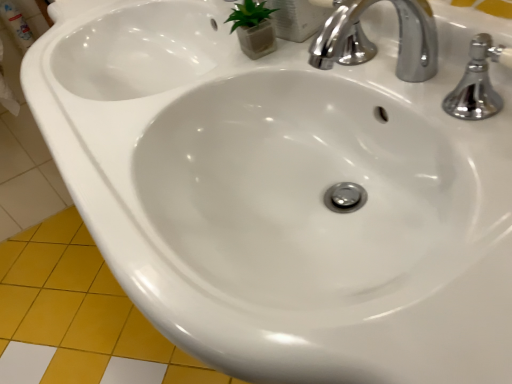
Locate an element on the screen. The width and height of the screenshot is (512, 384). polished chrome faucet at upper right is located at coordinates (476, 83).

The height and width of the screenshot is (384, 512). What do you see at coordinates (476, 83) in the screenshot?
I see `polished chrome faucet at upper right` at bounding box center [476, 83].

This screenshot has width=512, height=384. I want to click on yellow matte tile at lower left, so click(x=78, y=316).

The height and width of the screenshot is (384, 512). Describe the element at coordinates (78, 316) in the screenshot. I see `yellow matte tile at lower left` at that location.

You are a GUI agent. You are given a task and a screenshot of the screen. Output one action in this format:
    pyautogui.click(x=<x>, y=<y>)
    Task: Click on the polished chrome faucet at upper right
    
    Given the screenshot: What is the action you would take?
    pyautogui.click(x=476, y=83)

Which is more to the right, polished chrome faucet at upper right or yellow matte tile at lower left?

From the viewer's perspective, polished chrome faucet at upper right appears more on the right side.

Does polished chrome faucet at upper right come behind yellow matte tile at lower left?

No, polished chrome faucet at upper right is in front of yellow matte tile at lower left.

Does point (493, 94) come farther from viewer compared to point (110, 334)?

No.

From the image's perspective, is polished chrome faucet at upper right located above yellow matte tile at lower left?

Correct, polished chrome faucet at upper right appears higher than yellow matte tile at lower left in the image.

Consider the image. From a real-world perspective, is polished chrome faucet at upper right physically located above or below yellow matte tile at lower left?

polished chrome faucet at upper right is above yellow matte tile at lower left.

Which object is wider, polished chrome faucet at upper right or yellow matte tile at lower left?

yellow matte tile at lower left.

From their relative heights in the image, would you say polished chrome faucet at upper right is taller or shorter than yellow matte tile at lower left?

Considering their sizes, polished chrome faucet at upper right has more height than yellow matte tile at lower left.

Between polished chrome faucet at upper right and yellow matte tile at lower left, which one has smaller size?

polished chrome faucet at upper right.

Would you say polished chrome faucet at upper right is outside yellow matte tile at lower left?

Absolutely, polished chrome faucet at upper right is external to yellow matte tile at lower left.

Is polished chrome faucet at upper right positioned far away from yellow matte tile at lower left?

polished chrome faucet at upper right is far away from yellow matte tile at lower left.

Is polished chrome faucet at upper right aimed at yellow matte tile at lower left?

No, polished chrome faucet at upper right is not turned towards yellow matte tile at lower left.

This screenshot has height=384, width=512. In order to click on ceramic tile lying behind the polished chrome faucet at upper right in this screenshot , I will do `click(78, 316)`.

Considering the relative positions of yellow matte tile at lower left and polished chrome faucet at upper right in the image provided, is yellow matte tile at lower left to the right of polished chrome faucet at upper right from the viewer's perspective?

No, yellow matte tile at lower left is not to the right of polished chrome faucet at upper right.

In the image, is yellow matte tile at lower left positioned in front of or behind polished chrome faucet at upper right?

Visually, yellow matte tile at lower left is located behind polished chrome faucet at upper right.

Does point (80, 354) come in front of point (510, 58)?

No.

In the scene shown: From the image's perspective, does yellow matte tile at lower left appear lower than polished chrome faucet at upper right?

Yes.

From a real-world perspective, between yellow matte tile at lower left and polished chrome faucet at upper right, who is vertically lower?

yellow matte tile at lower left.

Considering the sizes of objects yellow matte tile at lower left and polished chrome faucet at upper right in the image provided, who is thinner, yellow matte tile at lower left or polished chrome faucet at upper right?

With smaller width is polished chrome faucet at upper right.

Considering the sizes of yellow matte tile at lower left and polished chrome faucet at upper right in the image, is yellow matte tile at lower left taller or shorter than polished chrome faucet at upper right?

Clearly, yellow matte tile at lower left is shorter compared to polished chrome faucet at upper right.

Who is smaller, yellow matte tile at lower left or polished chrome faucet at upper right?

polished chrome faucet at upper right is smaller.

Consider the image. Which is correct: yellow matte tile at lower left is inside polished chrome faucet at upper right, or outside of it?

yellow matte tile at lower left is outside polished chrome faucet at upper right.

Are yellow matte tile at lower left and polished chrome faucet at upper right making contact?

No, yellow matte tile at lower left is not with polished chrome faucet at upper right.

Is yellow matte tile at lower left facing away from polished chrome faucet at upper right?

yellow matte tile at lower left is not turned away from polished chrome faucet at upper right.

This screenshot has height=384, width=512. Identify the location of ceramic tile on the left of the polished chrome faucet at upper right. (78, 316).

At what (x,y) coordinates should I click in order to perform the action: click on tap that appears above the yellow matte tile at lower left (from a real-world perspective). Please return your answer as a coordinate pair (x, y). The width and height of the screenshot is (512, 384). Looking at the image, I should click on (476, 83).

Where is `ceramic tile below the polished chrome faucet at upper right (from a real-world perspective)`? The height and width of the screenshot is (384, 512). ceramic tile below the polished chrome faucet at upper right (from a real-world perspective) is located at coordinates (78, 316).